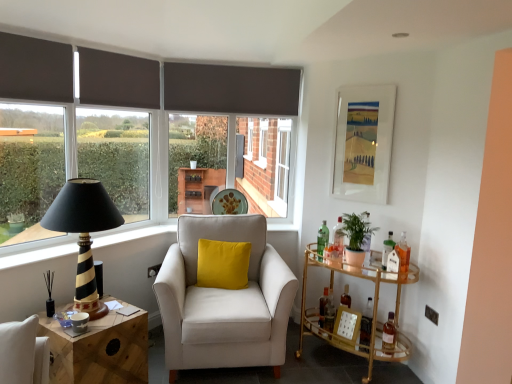
Question: From the image's perspective, is green leafy plant at right positioned above or below dark grey fabric curtain at upper left, which is the 1th curtain in left-to-right order?

Choices:
 (A) below
 (B) above

Answer: (A)

Question: Looking at their shapes, would you say green leafy plant at right is wider or thinner than dark grey fabric curtain at upper left, which is the 1th curtain in left-to-right order?

Choices:
 (A) wide
 (B) thin

Answer: (A)

Question: Estimate the real-world distances between objects in this image. Which object is farther from the green leafy plant at right?

Choices:
 (A) metallic silver power outlet at lower right
 (B) matte brown curtain at left
 (C) wooden side table at lower left, which is the first table from left to right
 (D) velvet yellow pillow at center
 (E) white fabric armchair at center

Answer: (B)

Question: Estimate the real-world distances between objects in this image. Which object is closer to the clear glass door at center?

Choices:
 (A) gold glass bar cart at right, the second table from the left
 (B) dark grey fabric curtain at upper center, which ranks as the 2th curtain in left-to-right order
 (C) white matte picture frame at upper right, marked as the 2th picture frame in a bottom-to-top arrangement
 (D) wooden side table at lower left, which is counted as the second table, starting from the right
 (E) black painted wood lighthouse at left

Answer: (C)